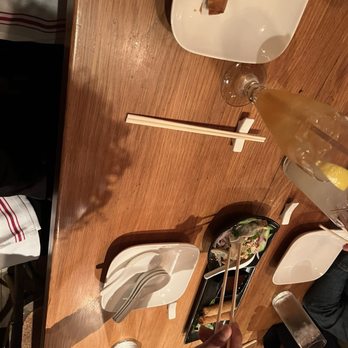
I want to click on wood table top, so click(x=254, y=235), click(x=161, y=186).